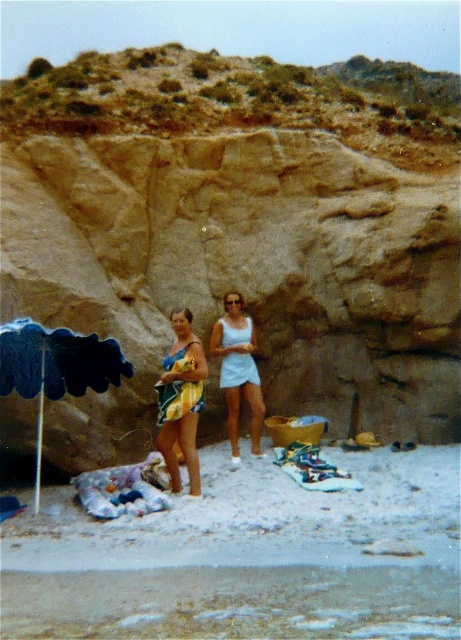
In the scene shown: How distant is brown rock cliff at center from light blue fabric dress at center?

brown rock cliff at center and light blue fabric dress at center are 2.67 meters apart from each other.

Does brown rock cliff at center lie behind light blue fabric dress at center?

No, brown rock cliff at center is in front of light blue fabric dress at center.

This screenshot has width=461, height=640. Identify the location of brown rock cliff at center. (236, 234).

Locate an element on the screen. The image size is (461, 640). brown rock cliff at center is located at coordinates (236, 234).

I want to click on blue fabric umbrella at left, so click(55, 369).

From the picture: Does blue fabric umbrella at left have a lesser height compared to light blue fabric dress at center?

Yes, blue fabric umbrella at left is shorter than light blue fabric dress at center.

Measure the distance between point (x=53, y=364) and camera.

Point (x=53, y=364) is 33.99 feet away from camera.

Locate an element on the screen. blue fabric umbrella at left is located at coordinates (55, 369).

From the picture: Who is positioned more to the left, brown rock cliff at center or yellow striped swimsuit at center?

yellow striped swimsuit at center

Between point (282, 92) and point (165, 417), which one is positioned in front?

Positioned in front is point (165, 417).

Where is `brown rock cliff at center`? This screenshot has height=640, width=461. brown rock cliff at center is located at coordinates (236, 234).